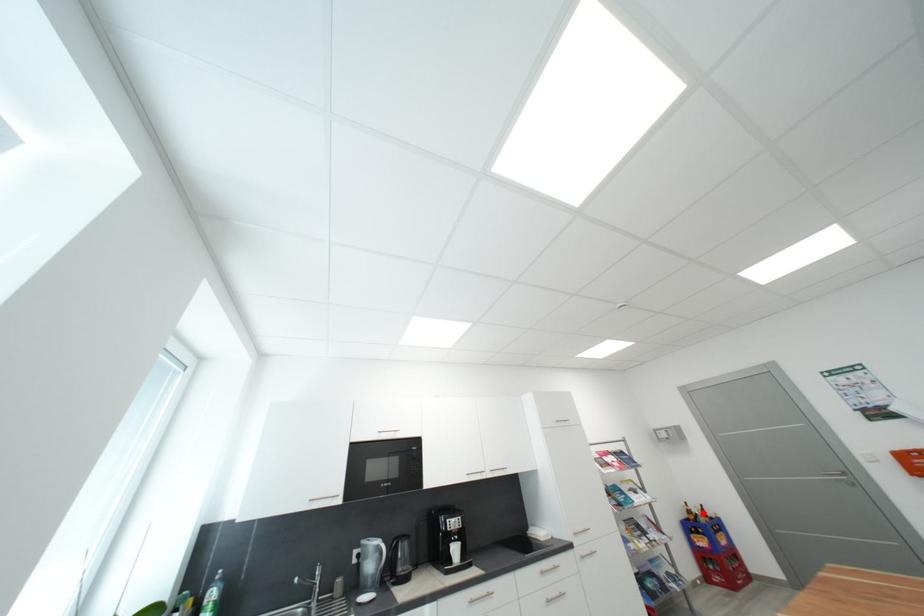
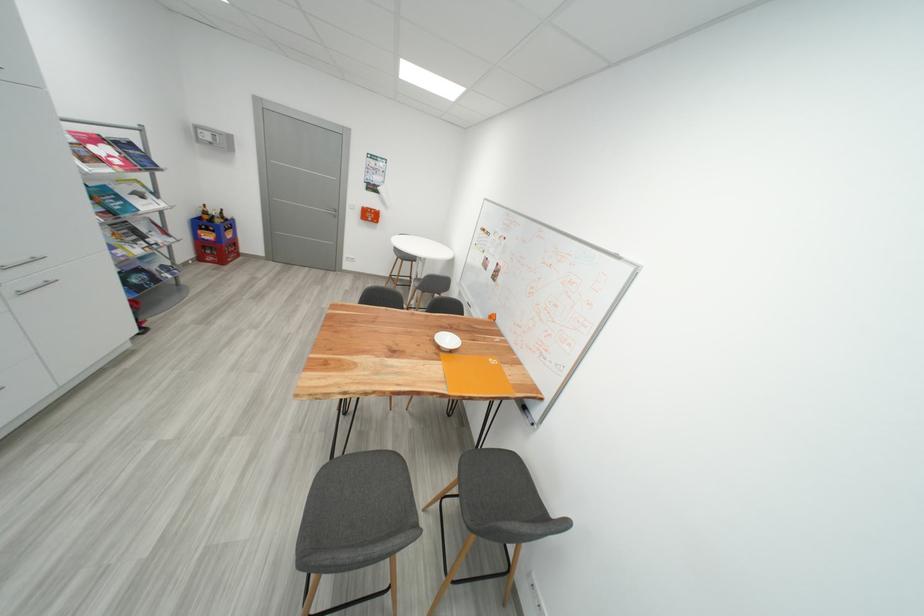
Question: I am providing you with two images of the same scene from different viewpoints. Given a red point in image1, look at the same physical point in image2. Is it:

Choices:
 (A) Closer to the viewpoint
 (B) Farther from the viewpoint

Answer: (A)